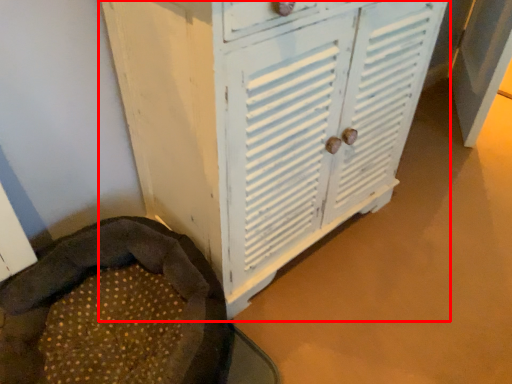
Question: From the image's perspective, where is cupboard (annotated by the red box) located in relation to bean bag chair in the image?

Choices:
 (A) above
 (B) below

Answer: (A)